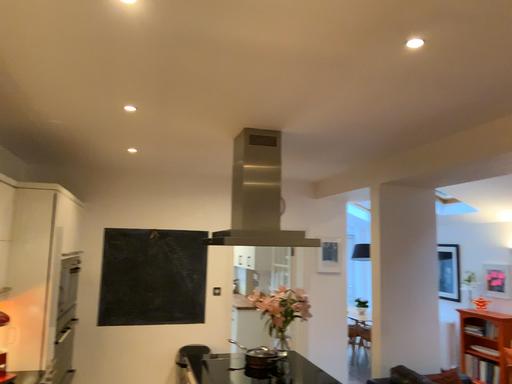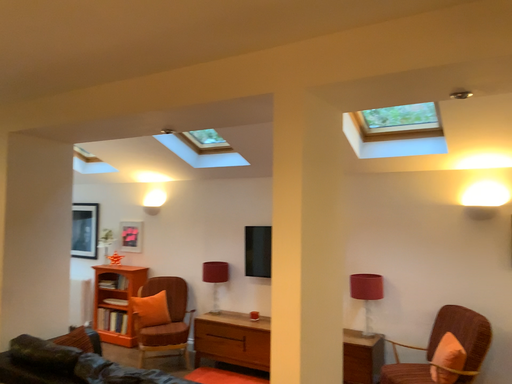
Question: How did the camera likely rotate when shooting the video?

Choices:
 (A) rotated downward
 (B) rotated upward

Answer: (A)